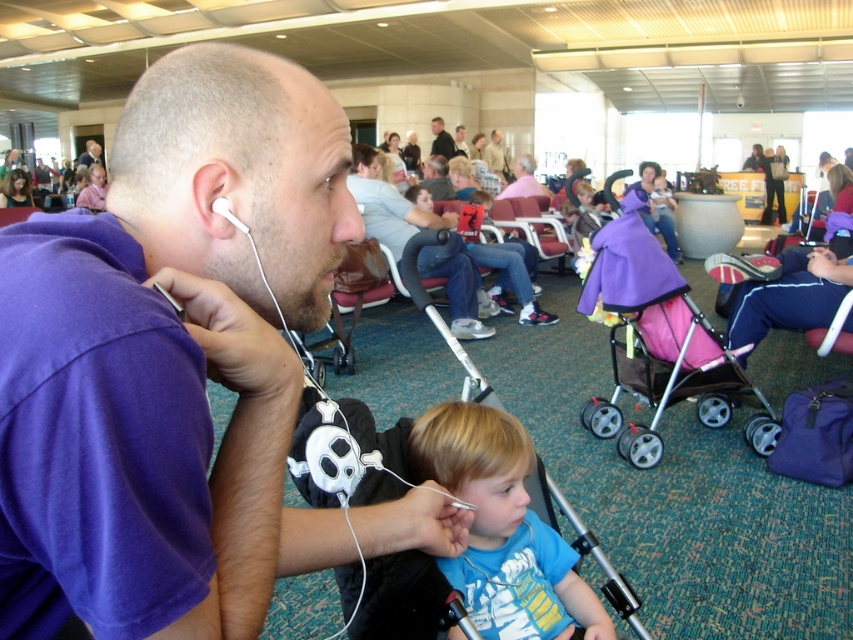
From the picture: You are a photographer positioned at the back of the airport terminal. You need to take a photo of both the purple cotton shirt at center and the matte black jacket at upper left. Which object should you focus on first to ensure it appears in sharp focus?

The purple cotton shirt at center is closer to the viewer than the matte black jacket at upper left, so you should focus on the purple cotton shirt at center first to ensure it appears sharp. Adjusting focus for the matte black jacket at upper left may require refocusing due to its distance.

Based on the photo, you are a traveler who just entered the airport terminal and see the pink fabric jacket at center and the white earphone at ear. Which object is higher in the image?

The pink fabric jacket at center is above the white earphone at ear, so the pink fabric jacket at center is higher in the image.

Consider the image. You are an airport security agent checking passengers. You see a man in a purple cotton shirt at center and a child in a light brown leather jacket at center. Which one is positioned more to the left side?

The purple cotton shirt at center is positioned to the left of the light brown leather jacket at center, so the man in the purple cotton shirt at center is more to the left side.